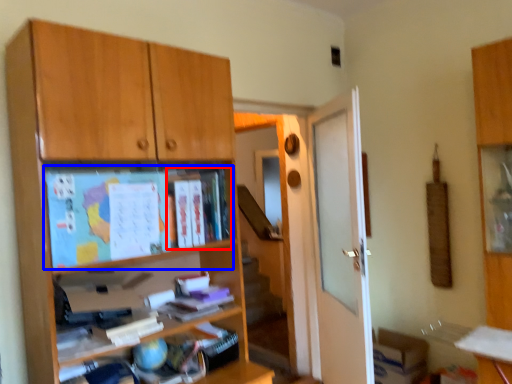
Question: Which object appears farthest to the camera in this image, book (highlighted by a red box) or paperback book (highlighted by a blue box)?

Choices:
 (A) book
 (B) paperback book

Answer: (A)